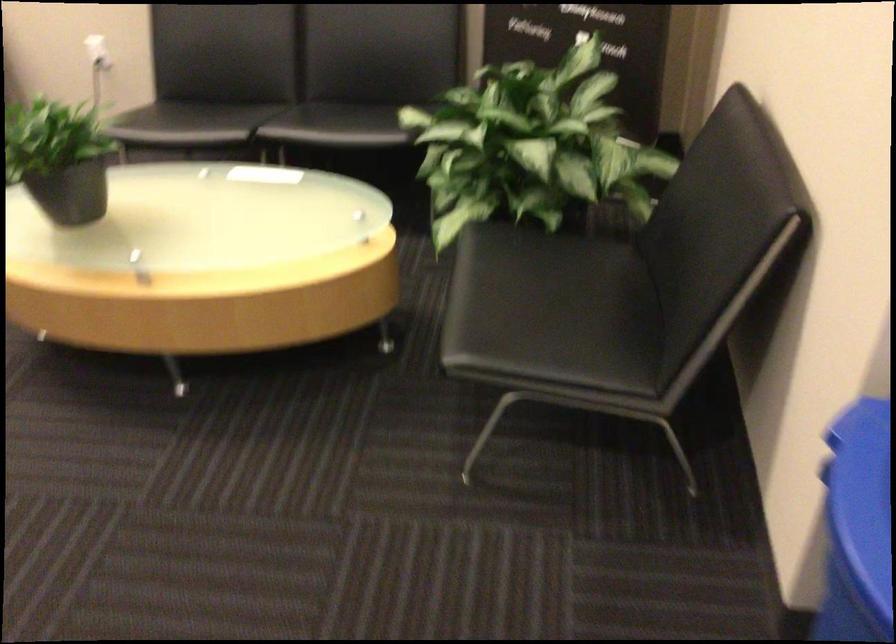
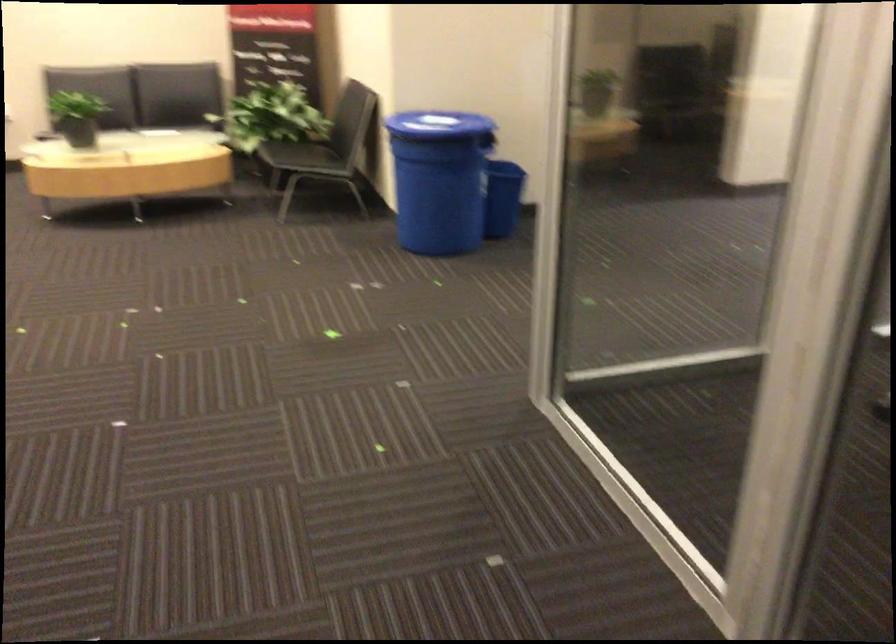
Where in the second image is the point corresponding to point 115,127 from the first image?

(76, 116)